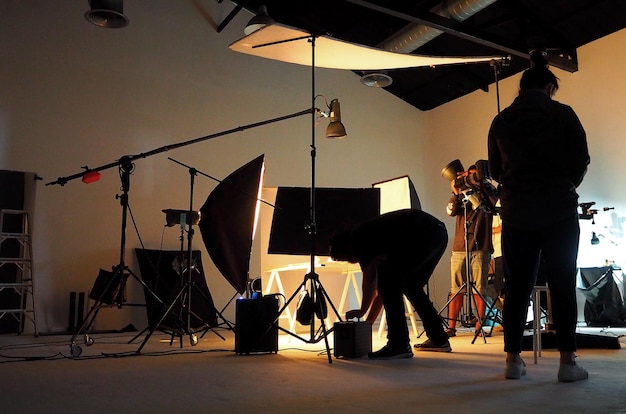
Find the location of a particular element. walls is located at coordinates (180, 117), (597, 111).